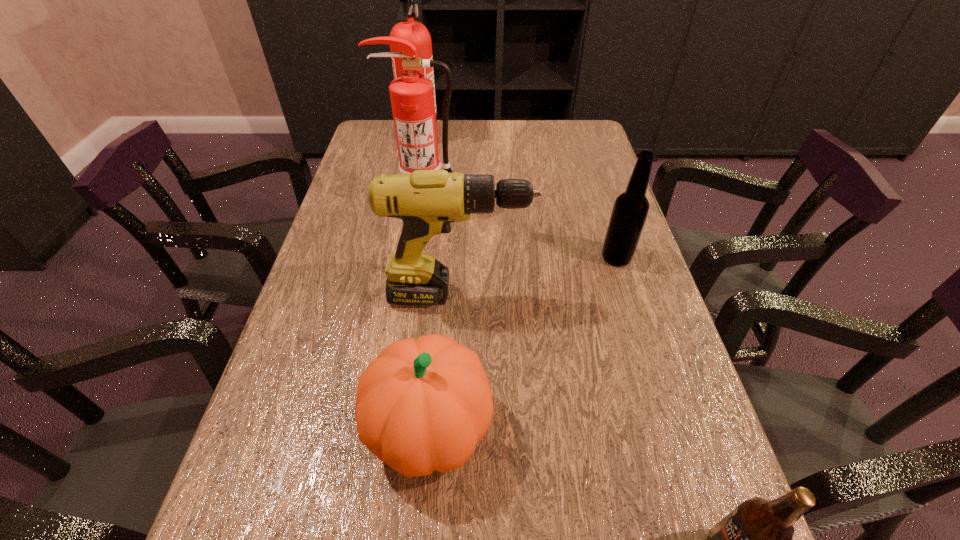
Where is `the farther fire extinguisher`? The width and height of the screenshot is (960, 540). the farther fire extinguisher is located at coordinates [x=409, y=29].

Identify the location of the fifth nearest object. click(412, 96).

Identify the location of drill. The height and width of the screenshot is (540, 960). (427, 201).

Where is `the taller beer bottle`? the taller beer bottle is located at coordinates (630, 210).

Image resolution: width=960 pixels, height=540 pixels. Find the location of `the third farthest object`. the third farthest object is located at coordinates (630, 210).

In order to click on the fifth farthest object in this screenshot , I will do `click(422, 406)`.

This screenshot has height=540, width=960. Find the location of `blank area located 0.380m on the handle side of the farthest object`. blank area located 0.380m on the handle side of the farthest object is located at coordinates (554, 135).

Image resolution: width=960 pixels, height=540 pixels. What are the coordinates of `vacant region located at the nozzle of the second farthest object` in the screenshot? It's located at (417, 284).

This screenshot has height=540, width=960. Identify the location of vacant area situated 0.270m on the handle side of the drill. (652, 295).

The height and width of the screenshot is (540, 960). I want to click on free space located on the front of the fourth nearest object, so click(x=636, y=322).